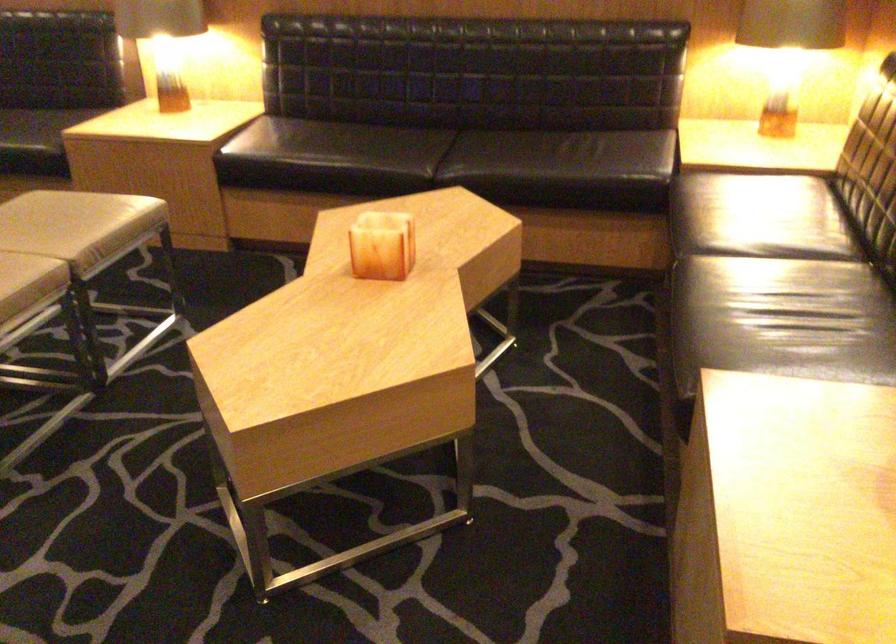
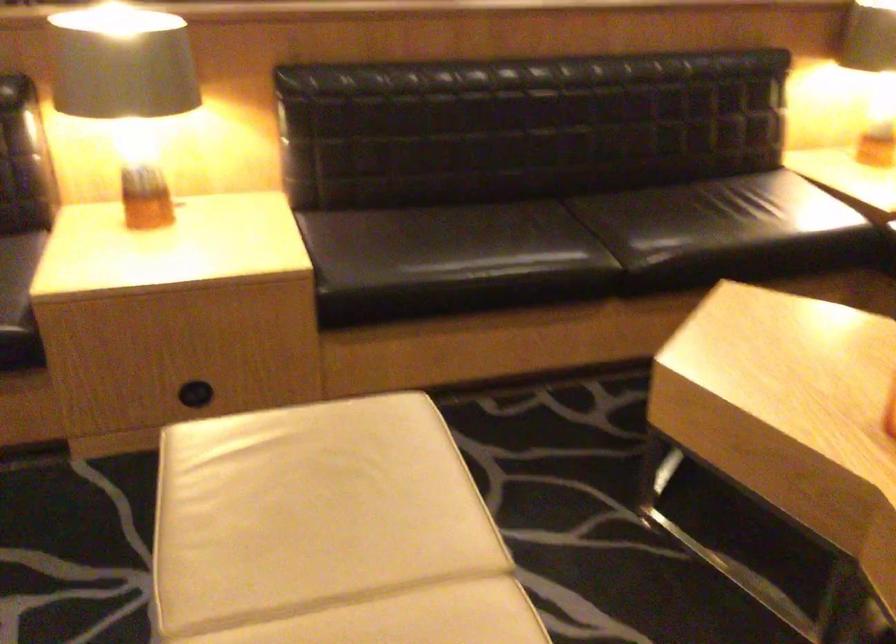
Which direction would the cameraman need to move to produce the second image?

The cameraman walked toward left, forward.